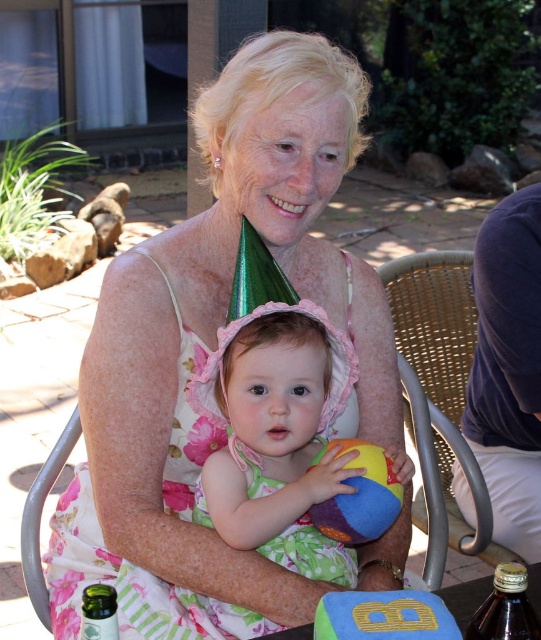
In the scene shown: Who is positioned more to the left, multicolored fabric beach ball at center or brown glass bottle at lower right?

From the viewer's perspective, multicolored fabric beach ball at center appears more on the left side.

Is multicolored fabric beach ball at center below brown glass bottle at lower right?

Incorrect, multicolored fabric beach ball at center is not positioned below brown glass bottle at lower right.

Who is more distant from viewer, (x=371, y=465) or (x=527, y=620)?

The point (x=371, y=465) is more distant.

Find the location of a particular element. Image resolution: width=541 pixels, height=640 pixels. multicolored fabric beach ball at center is located at coordinates (359, 497).

Who is more distant from viewer, (249,61) or (319,632)?

The point (249,61) is behind.

I want to click on matte floral dress at center, so (x=214, y=340).

Identify the location of multicolored fabric beach ball at center. The width and height of the screenshot is (541, 640). (359, 497).

Between point (355, 544) and point (95, 637), which one is positioned in front?

Point (95, 637)

At what (x,y) coordinates should I click in order to perform the action: click on multicolored fabric beach ball at center. Please return your answer as a coordinate pair (x, y). Image resolution: width=541 pixels, height=640 pixels. Looking at the image, I should click on (359, 497).